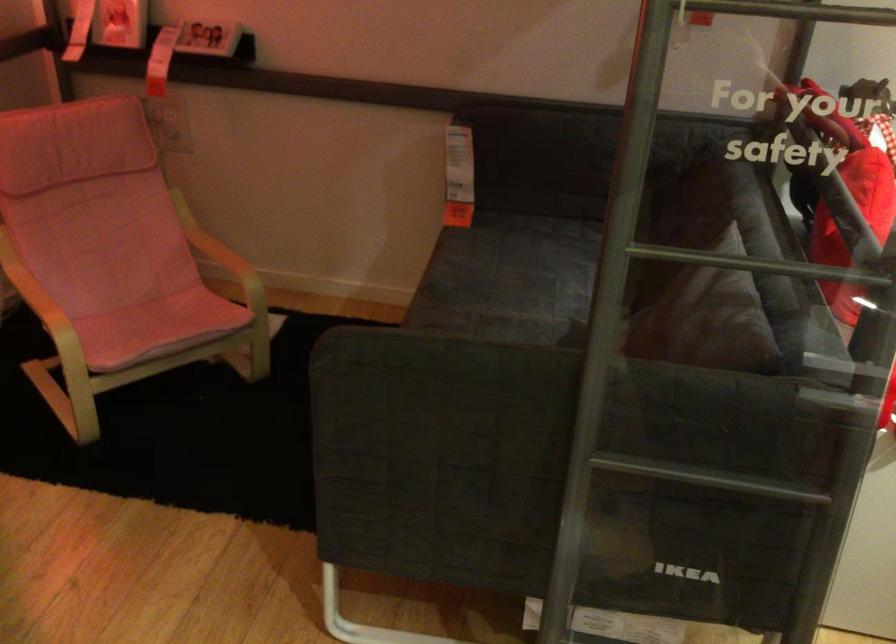
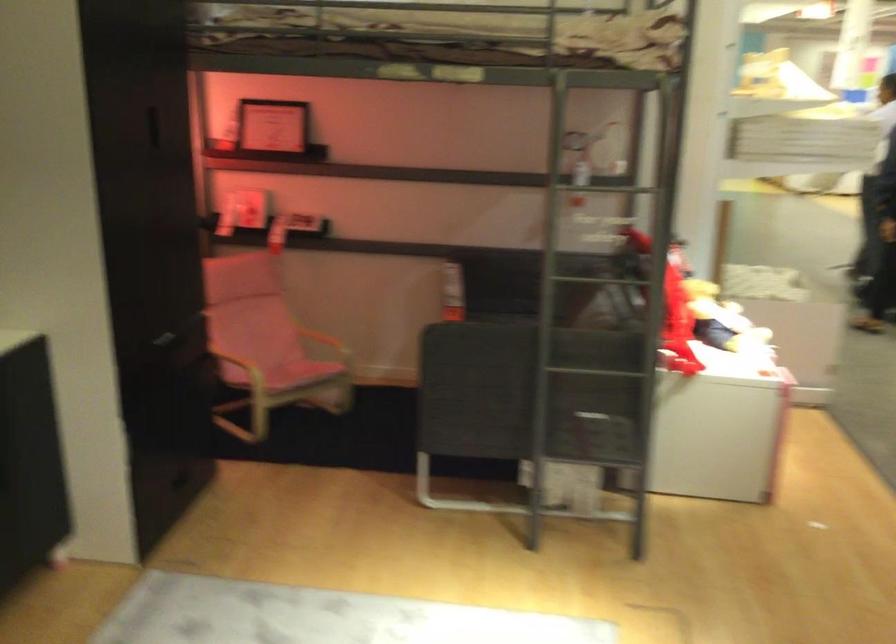
Where in the second image is the point corresponding to (x=704, y=471) from the first image?

(610, 374)